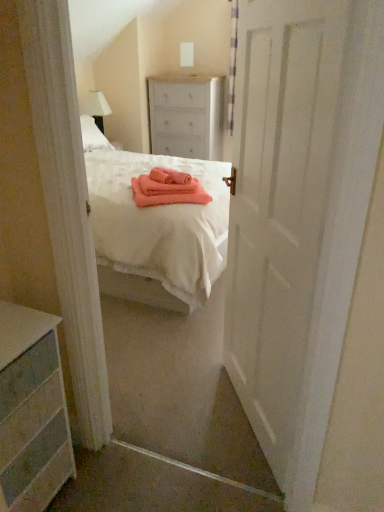
Identify the location of free spot above white painted wood dresser at lower left, marked as the second chest of drawers in a right-to-left arrangement (from a real-world perspective). The image size is (384, 512). tap(19, 322).